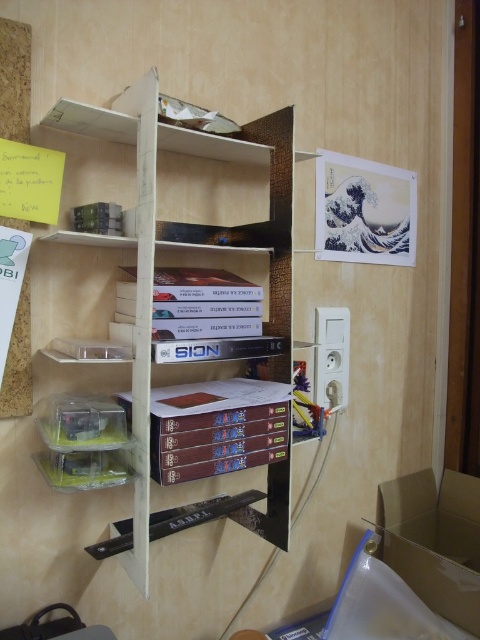
Which is below, white matte bookshelf at center or hardcover book at center?

hardcover book at center is below.

Is white matte bookshelf at center to the right of hardcover book at center from the viewer's perspective?

In fact, white matte bookshelf at center is to the left of hardcover book at center.

Between point (276, 182) and point (233, 451), which one is positioned behind?

Positioned behind is point (276, 182).

You are a GUI agent. You are given a task and a screenshot of the screen. Output one action in this format:
    pyautogui.click(x=<x>, y=<y>)
    Task: Click on the white matte bookshelf at center
    This screenshot has width=480, height=640.
    Given the screenshot: What is the action you would take?
    pyautogui.click(x=186, y=244)

Who is shorter, white matte bookshelf at center or cardboard box at lower right?

cardboard box at lower right

Can you confirm if white matte bookshelf at center is shorter than cardboard box at lower right?

In fact, white matte bookshelf at center may be taller than cardboard box at lower right.

The width and height of the screenshot is (480, 640). In order to click on white matte bookshelf at center in this screenshot , I will do `click(186, 244)`.

Is point (439, 611) closer to camera compared to point (286, 408)?

No, (439, 611) is behind (286, 408).

Measure the distance between point (444, 522) and camera.

Point (444, 522) and camera are 5.55 feet apart.

Which is behind, point (430, 554) or point (120, 396)?

The point (430, 554) is behind.

Find the location of a particular element. cardboard box at lower right is located at coordinates [x=433, y=540].